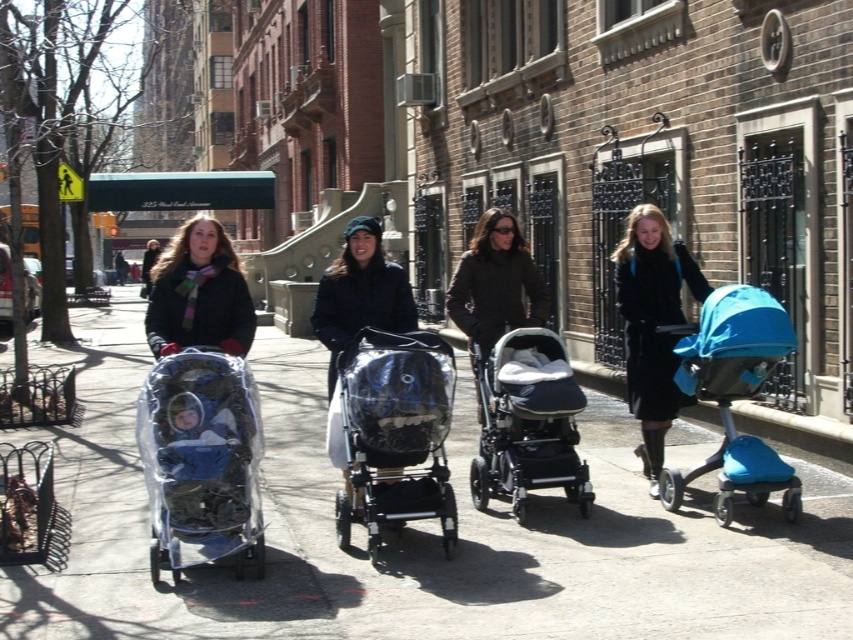
Question: Which point is closer to the camera?

Choices:
 (A) (492, 282)
 (B) (706, 362)
 (C) (431, 394)
 (D) (515, 440)

Answer: (C)

Question: Which point is farther to the camera?

Choices:
 (A) (251, 333)
 (B) (221, 452)

Answer: (A)

Question: Considering the relative positions of matte black stroller at right and matte black stroller at center in the image provided, where is matte black stroller at right located with respect to matte black stroller at center?

Choices:
 (A) right
 (B) left

Answer: (A)

Question: Estimate the real-world distances between objects in this image. Which object is farther from the blue fabric baby carriage at left?

Choices:
 (A) teal fabric stroller at right
 (B) matte black stroller at right
 (C) transparent plastic stroller at left

Answer: (B)

Question: Can you confirm if blue fabric baby carriage at left is wider than matte black stroller at center?

Choices:
 (A) no
 (B) yes

Answer: (A)

Question: Is the position of clear concrete sidewalk at center more distant than that of matte black coat at center?

Choices:
 (A) yes
 (B) no

Answer: (B)